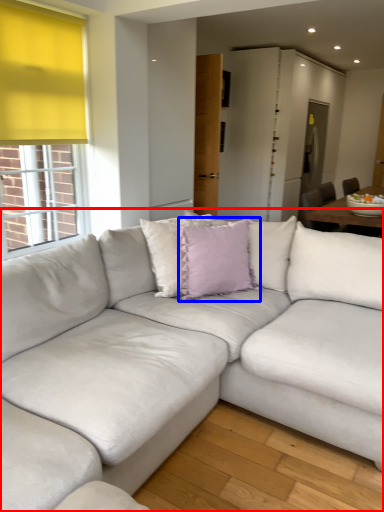
Question: Which object appears farthest to the camera in this image, studio couch (highlighted by a red box) or pillow (highlighted by a blue box)?

Choices:
 (A) studio couch
 (B) pillow

Answer: (B)